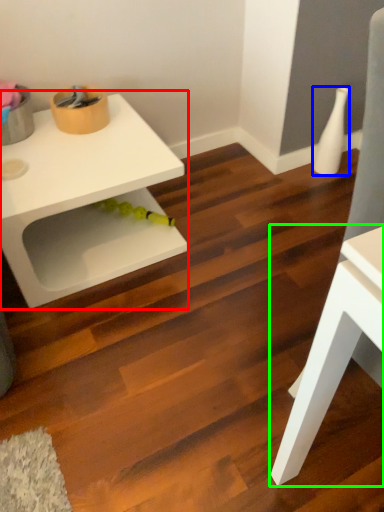
Question: Considering the real-world distances, which object is farthest from table (highlighted by a red box)? vase (highlighted by a blue box) or table (highlighted by a green box)?

Choices:
 (A) vase
 (B) table

Answer: (A)